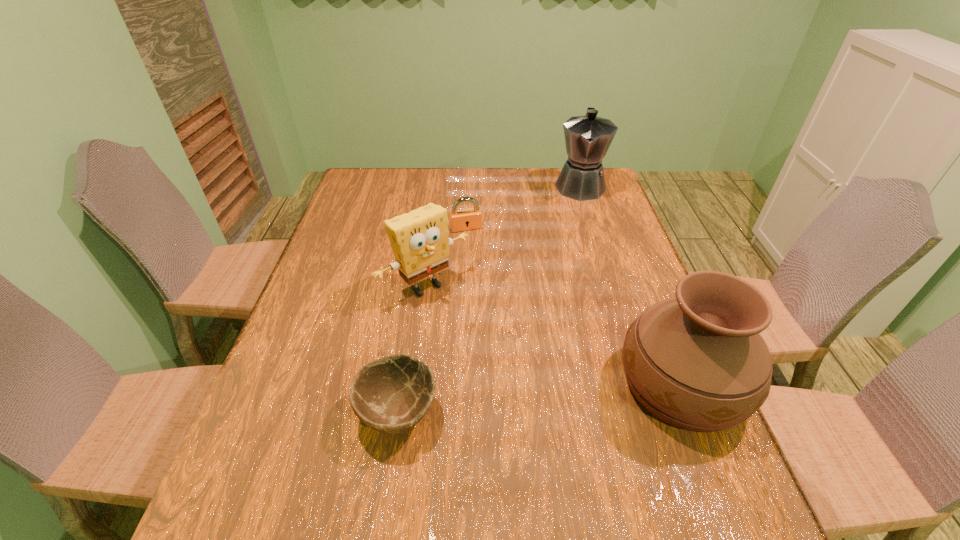
In order to click on vacant space located 0.360m at the spout of the farthest object in this screenshot , I will do `click(578, 274)`.

The width and height of the screenshot is (960, 540). Identify the location of free region located to unlock the fourth tallest object from the front. (504, 318).

Locate an element on the screen. vacant space located to unlock the fourth tallest object from the front is located at coordinates (481, 261).

Locate an element on the screen. blank area located to unlock the fourth tallest object from the front is located at coordinates 491,284.

Identify the location of free space located on the face of the third farthest object. This screenshot has height=540, width=960. (542, 401).

This screenshot has height=540, width=960. I want to click on free point located on the face of the third farthest object, so click(x=478, y=334).

Find the location of `vacant space situated 0.080m on the face of the third farthest object`. vacant space situated 0.080m on the face of the third farthest object is located at coordinates coord(468,324).

Where is `object that is at the far edge`? This screenshot has height=540, width=960. object that is at the far edge is located at coordinates (588, 138).

The width and height of the screenshot is (960, 540). I want to click on bowl that is at the near edge, so click(x=391, y=394).

This screenshot has width=960, height=540. What are the coordinates of `urn that is at the near edge` in the screenshot? It's located at (697, 362).